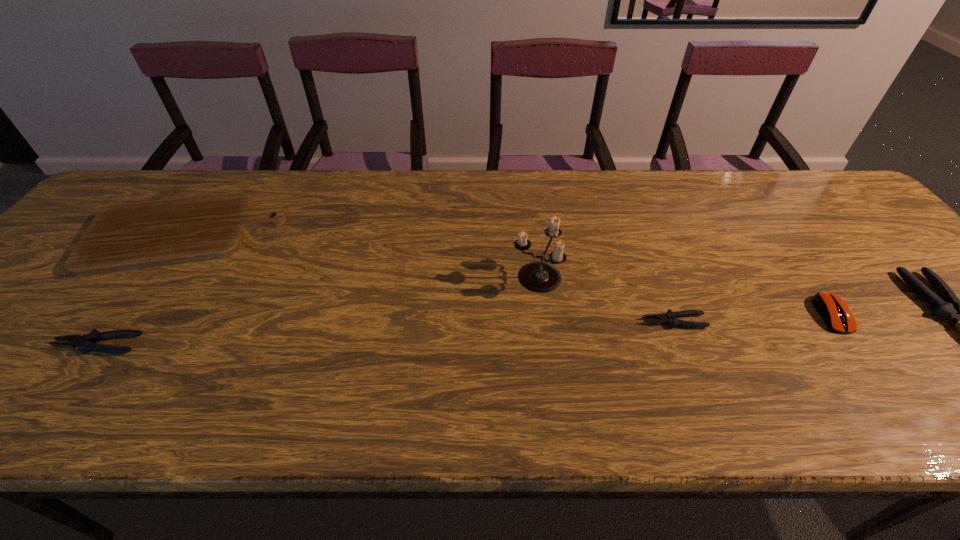
Locate an element on the screen. The width and height of the screenshot is (960, 540). vacant region at the left edge of the desktop is located at coordinates (0, 323).

In the image, there is a desktop. Where is `vacant space at the right edge`? Image resolution: width=960 pixels, height=540 pixels. vacant space at the right edge is located at coordinates (849, 243).

The width and height of the screenshot is (960, 540). In order to click on vacant area at the far right corner in this screenshot , I will do `click(793, 186)`.

Locate an element on the screen. Image resolution: width=960 pixels, height=540 pixels. vacant region between the second shortest pliers and the chopping board is located at coordinates (141, 289).

Identify the location of free space between the shortest object and the computer mouse. This screenshot has height=540, width=960. (753, 318).

The width and height of the screenshot is (960, 540). Identify the location of free space that is in between the second object from right to left and the second pliers from right to left. (753, 318).

Identify the location of vacant area that lies between the chopping board and the second tallest pliers. (141, 289).

In order to click on unoccupied area between the second object from right to left and the chopping board in this screenshot , I will do `click(508, 274)`.

Locate an element on the screen. This screenshot has width=960, height=540. unoccupied area between the chopping board and the computer mouse is located at coordinates (508, 274).

Image resolution: width=960 pixels, height=540 pixels. What are the coordinates of `vacant area between the leftmost pliers and the tallest object` in the screenshot? It's located at (317, 310).